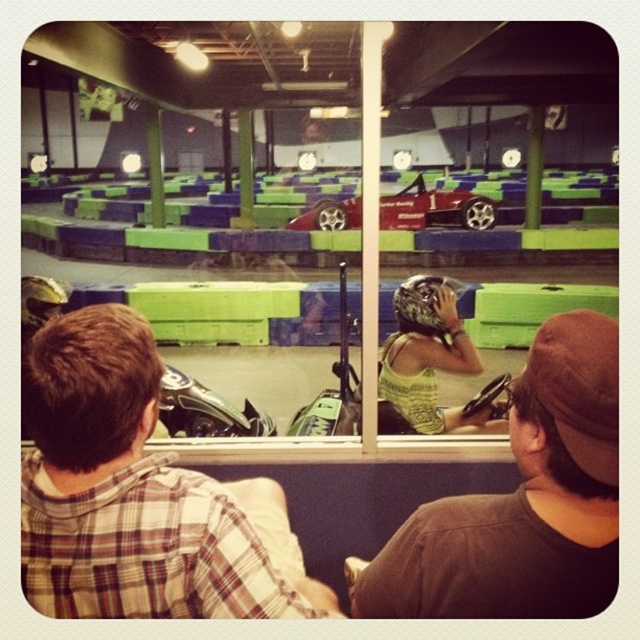
Locate an element on the screen. The image size is (640, 640). green tank top at center is located at coordinates click(522, 502).

Who is more distant from viewer, (454, 529) or (419, 404)?

The point (419, 404) is behind.

This screenshot has height=640, width=640. What do you see at coordinates (522, 502) in the screenshot? I see `green tank top at center` at bounding box center [522, 502].

This screenshot has width=640, height=640. Find the location of `green tank top at center`. green tank top at center is located at coordinates (522, 502).

Which is above, plaid shirt at center or green tank top at center?

Positioned higher is green tank top at center.

Is plaid shirt at center closer to camera compared to green tank top at center?

No, it is not.

Locate an element on the screen. This screenshot has width=640, height=640. plaid shirt at center is located at coordinates (129, 493).

Does transparent glass window at center lie in front of green patterned tank top at center?

Yes, transparent glass window at center is in front of green patterned tank top at center.

Who is positioned more to the right, transparent glass window at center or green patterned tank top at center?

Positioned to the right is green patterned tank top at center.

Image resolution: width=640 pixels, height=640 pixels. Find the location of `transparent glass window at center`. transparent glass window at center is located at coordinates (330, 230).